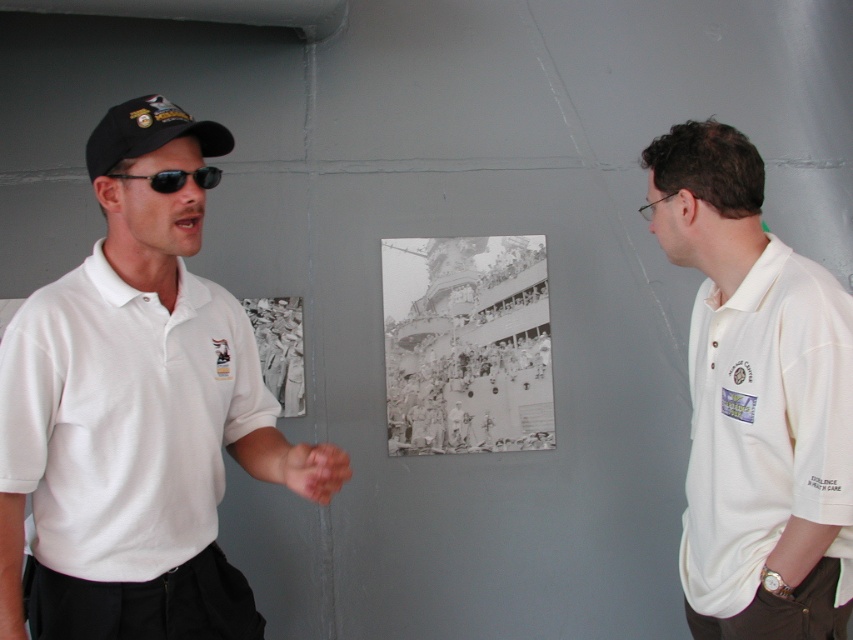
You are a security guard in the building. You need to check if the white cotton polo shirt at right is above or below the black reflective sunglasses at left. Based on the scene description, what is the relationship between their positions?

The white cotton polo shirt at right is located below the black reflective sunglasses at left.